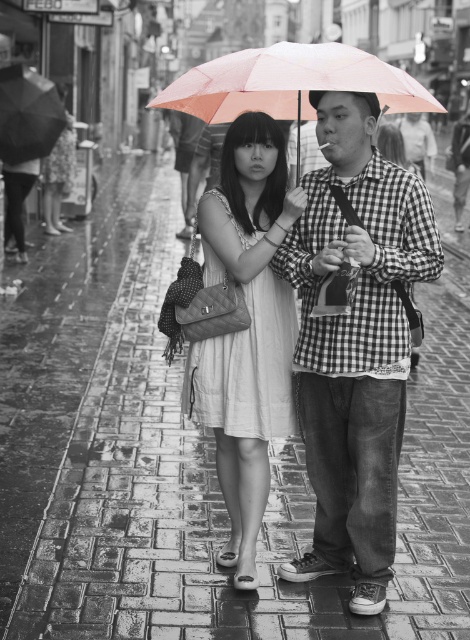
Question: In this image, where is checkered fabric shirt at center located relative to black matte umbrella at upper center?

Choices:
 (A) below
 (B) above

Answer: (A)

Question: Which object appears farthest from the camera in this image?

Choices:
 (A) checkered fabric shirt at center
 (B) black matte umbrella at upper center
 (C) white quilted purse at center

Answer: (B)

Question: Which point is farther to the camera?

Choices:
 (A) (329, 257)
 (B) (37, 154)

Answer: (B)

Question: Which object is positioned closest to the black matte umbrella at upper center?

Choices:
 (A) white quilted purse at center
 (B) checkered fabric shirt at center
 (C) pink translucent umbrella at center

Answer: (C)

Question: Is checkered fabric shirt at center below pink translucent umbrella at center?

Choices:
 (A) no
 (B) yes

Answer: (B)

Question: Does checkered fabric shirt at center appear over white quilted purse at center?

Choices:
 (A) no
 (B) yes

Answer: (B)